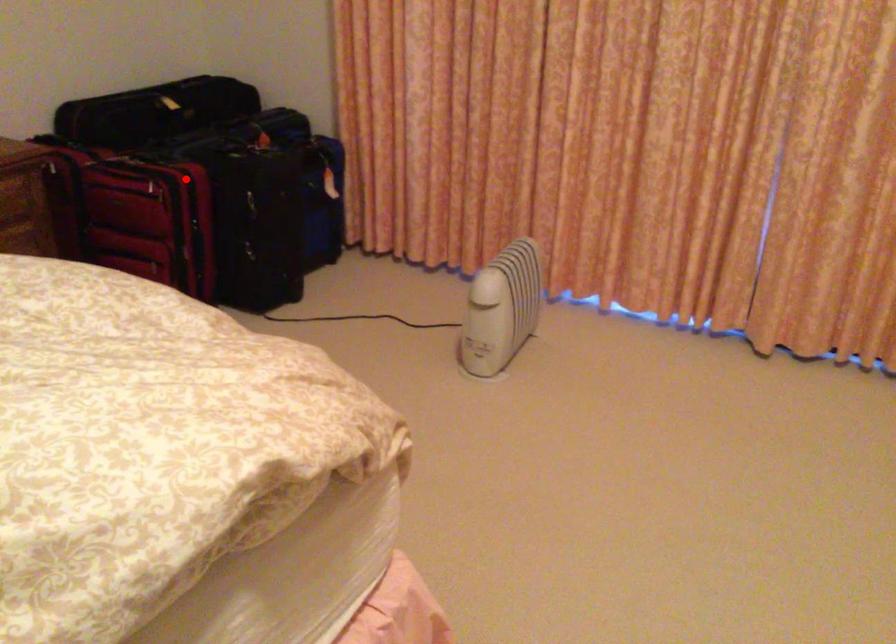
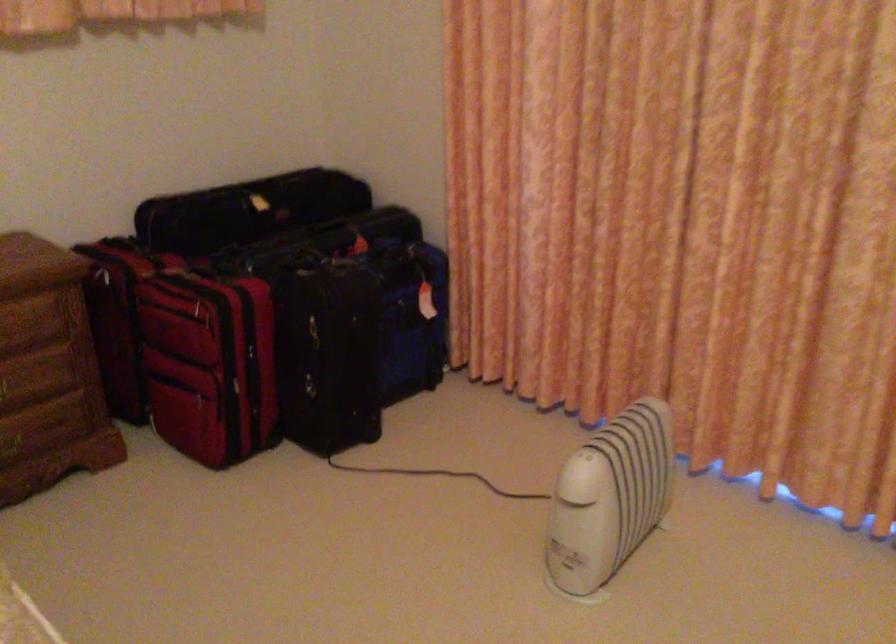
Question: I am providing you with two images of the same scene from different viewpoints. Image1 has a red point marked. In image2, the corresponding 3D location appears at what relative position? Reply with the corresponding letter.

Choices:
 (A) Closer
 (B) Farther

Answer: (A)